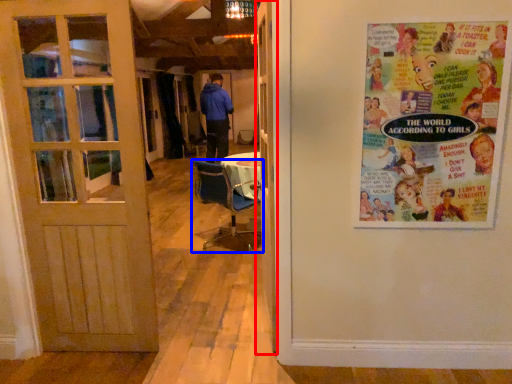
Question: Which point is further to the camera, door (highlighted by a red box) or chair (highlighted by a blue box)?

Choices:
 (A) door
 (B) chair

Answer: (B)